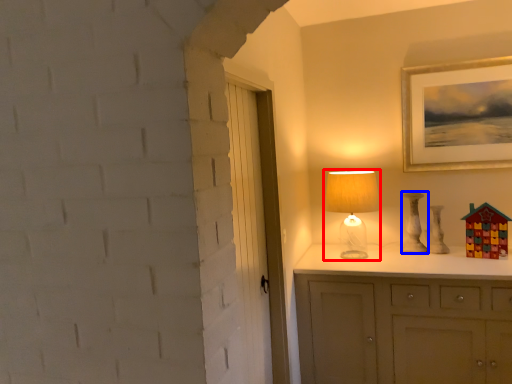
Question: Among these objects, which one is nearest to the camera, table lamp (highlighted by a red box) or lamp (highlighted by a blue box)?

Choices:
 (A) table lamp
 (B) lamp

Answer: (A)